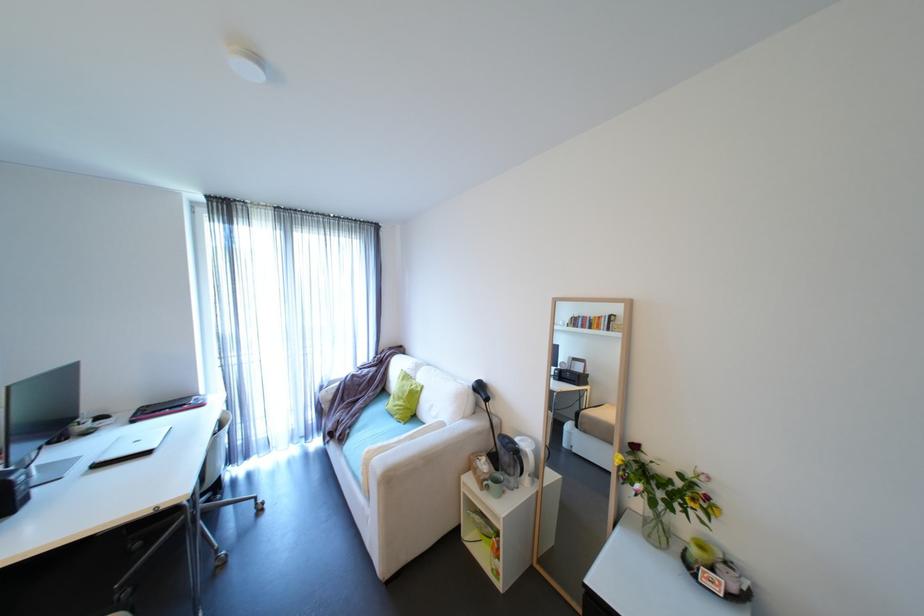
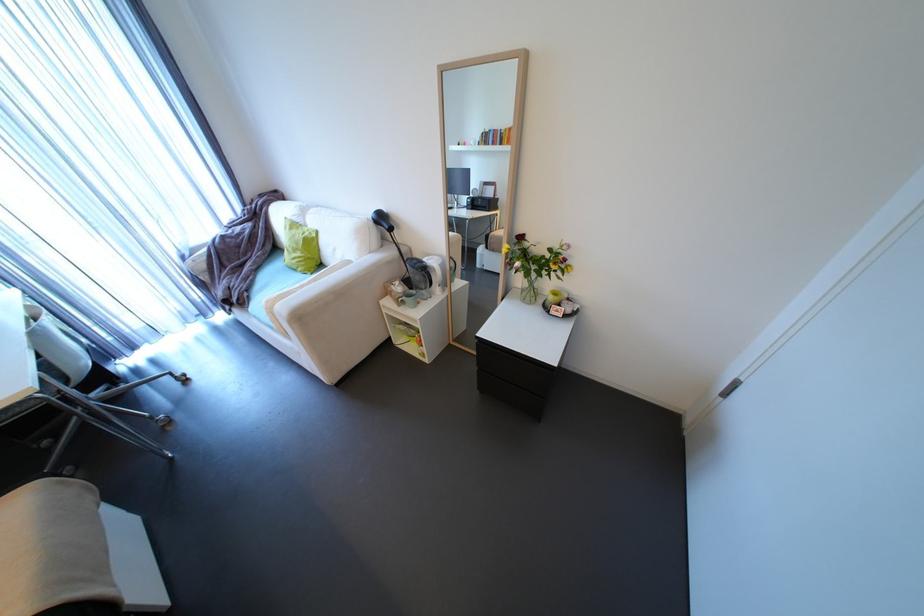
Find the pixel in the second image that matches the point at 333,386 in the first image.

(195, 254)